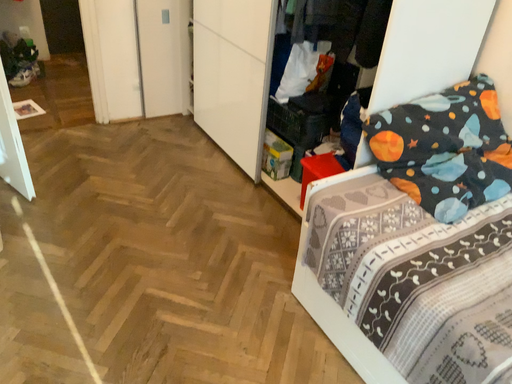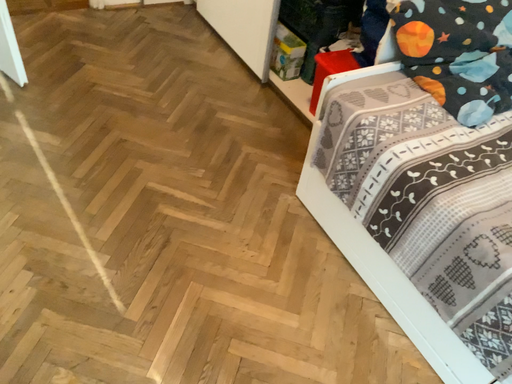
Question: How did the camera likely rotate when shooting the video?

Choices:
 (A) rotated upward
 (B) rotated downward

Answer: (B)